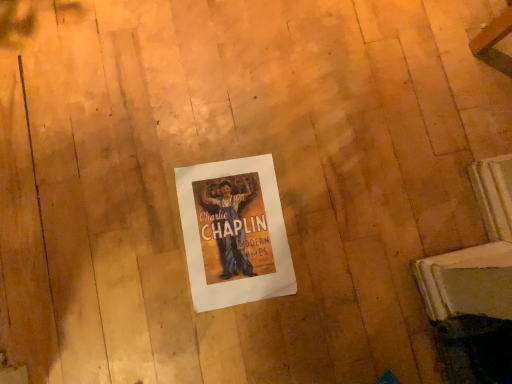
Measure the distance between point (186, 187) and camera.

A distance of 34.61 inches exists between point (186, 187) and camera.

The width and height of the screenshot is (512, 384). What do you see at coordinates (234, 232) in the screenshot? I see `white paper poster at center` at bounding box center [234, 232].

Where is `white paper poster at center`? The height and width of the screenshot is (384, 512). white paper poster at center is located at coordinates (234, 232).

Find the location of a particular element. white paper poster at center is located at coordinates (234, 232).